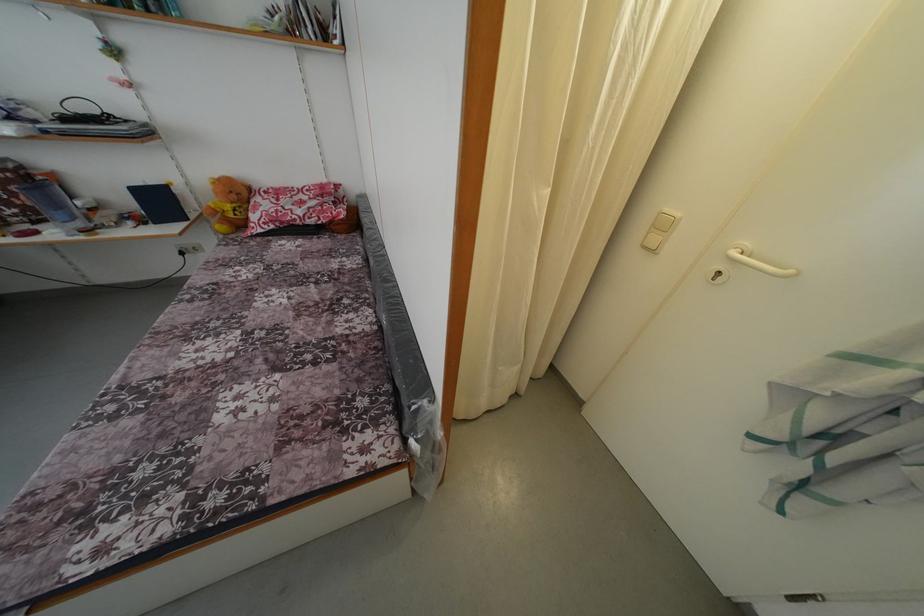
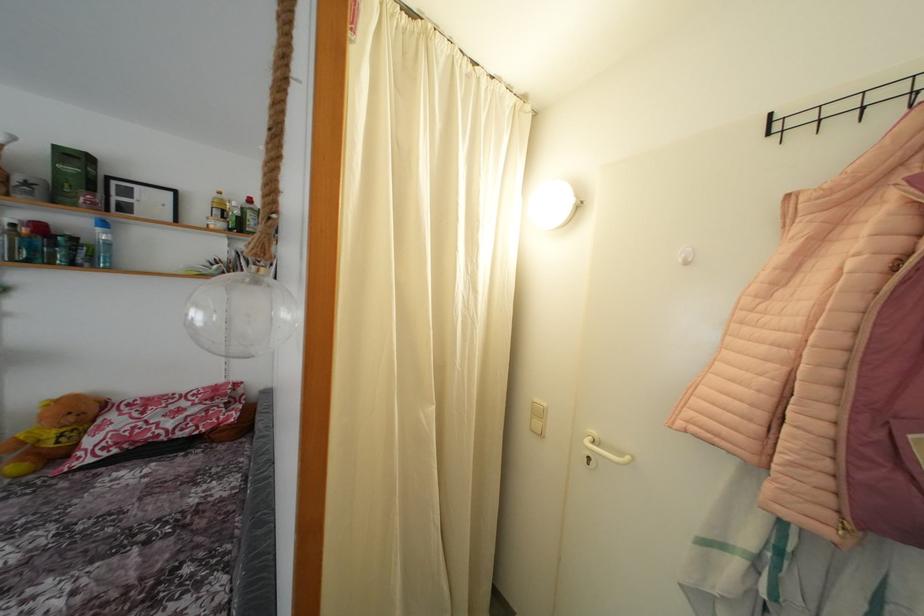
Find the pixel in the second image that matches point 672,216 in the first image.

(541, 406)